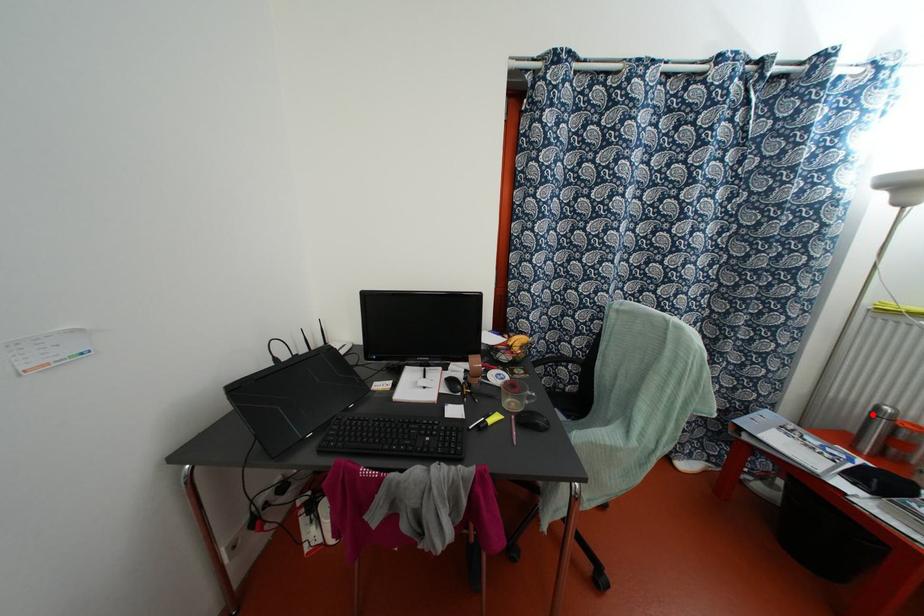
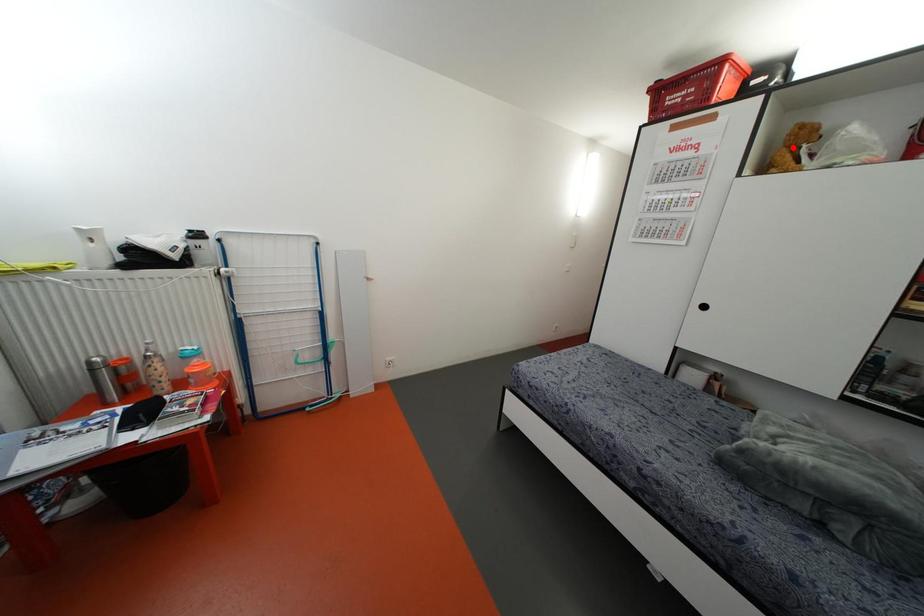
I am providing you with two images of the same scene from different viewpoints. A red point is marked on the first image and another point is marked on the second image. Does the point marked in image1 correspond to the same location as the one in image2?

No